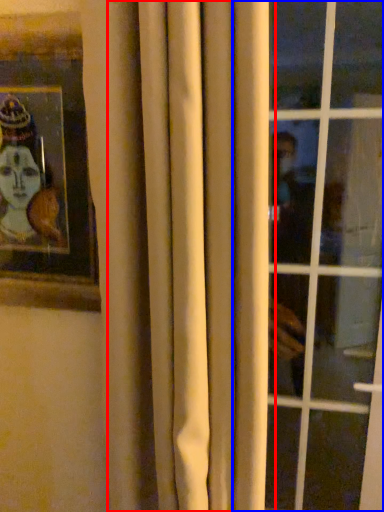
Question: Which object is closer to the camera taking this photo, curtain (highlighted by a red box) or window (highlighted by a blue box)?

Choices:
 (A) curtain
 (B) window

Answer: (A)